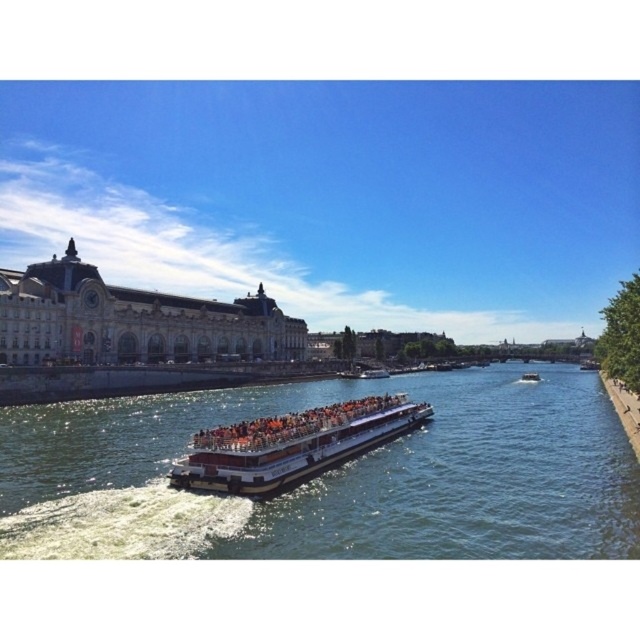
Which is above, white glossy boat at center or metallic silver boat at center?

white glossy boat at center

Can you confirm if white glossy boat at center is positioned to the right of metallic silver boat at center?

In fact, white glossy boat at center is to the left of metallic silver boat at center.

Which is in front, point (202, 444) or point (211, 445)?

Point (211, 445) is in front.

Locate an element on the screen. The image size is (640, 640). white glossy boat at center is located at coordinates (291, 444).

Can you confirm if greenish-blue water at center is taller than metallic silver boat at center?

Yes, greenish-blue water at center is taller than metallic silver boat at center.

Who is positioned more to the left, greenish-blue water at center or metallic silver boat at center?

metallic silver boat at center is more to the left.

Does point (572, 368) come behind point (216, 436)?

Yes, it is behind point (216, 436).

At what (x,y) coordinates should I click in order to perform the action: click on greenish-blue water at center. Please return your answer as a coordinate pair (x, y). This screenshot has height=640, width=640. Looking at the image, I should click on (348, 472).

Does greenish-blue water at center have a lesser height compared to white glossy boat at center?

Incorrect, greenish-blue water at center's height does not fall short of white glossy boat at center's.

This screenshot has height=640, width=640. I want to click on greenish-blue water at center, so [348, 472].

Locate an element on the screen. greenish-blue water at center is located at coordinates (348, 472).